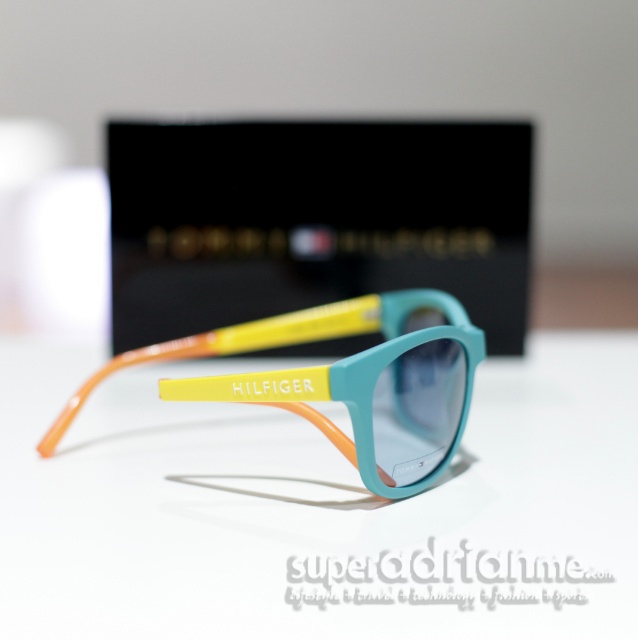
Question: Among these objects, which one is nearest to the camera?

Choices:
 (A) matte black box at upper center
 (B) white matte table at center
 (C) translucent orange and yellow plastic sunglasses at center

Answer: (B)

Question: Is matte black box at upper center below translucent orange and yellow plastic sunglasses at center?

Choices:
 (A) yes
 (B) no

Answer: (B)

Question: Observing the image, what is the correct spatial positioning of white matte table at center in reference to translucent orange and yellow plastic sunglasses at center?

Choices:
 (A) left
 (B) right

Answer: (B)

Question: Does matte black box at upper center appear on the left side of translucent orange and yellow plastic sunglasses at center?

Choices:
 (A) no
 (B) yes

Answer: (A)

Question: Which point appears closest to the camera in this image?

Choices:
 (A) (198, 198)
 (B) (357, 378)

Answer: (B)

Question: Which object is closer to the camera taking this photo?

Choices:
 (A) translucent orange and yellow plastic sunglasses at center
 (B) matte black box at upper center

Answer: (A)